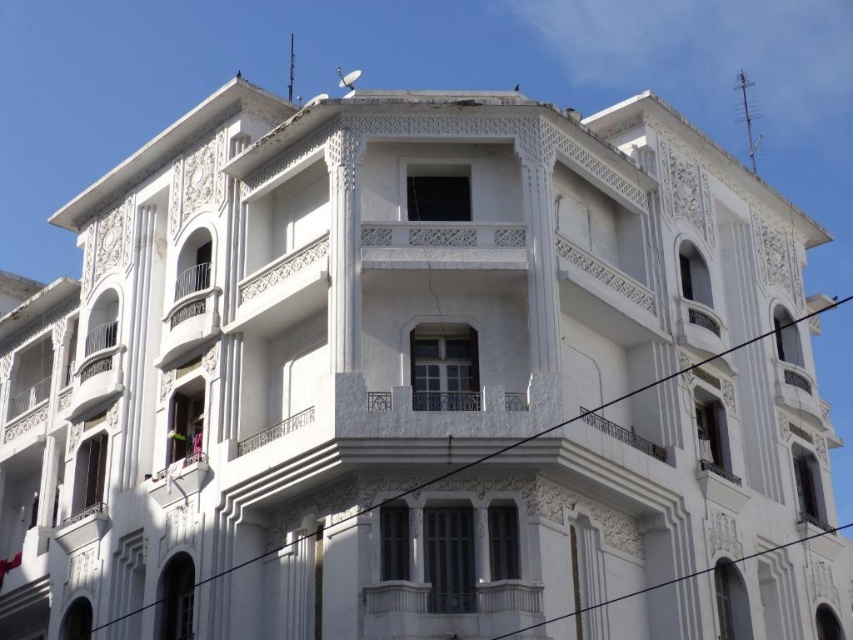
Question: Which of the following is the farthest from the observer?

Choices:
 (A) metallic wire at lower right
 (B) black wire at center

Answer: (B)

Question: Which point is closer to the camera?

Choices:
 (A) black wire at center
 (B) metallic wire at lower right

Answer: (B)

Question: In this image, where is black wire at center located relative to metallic wire at lower right?

Choices:
 (A) above
 (B) below

Answer: (A)

Question: In this image, where is black wire at center located relative to metallic wire at lower right?

Choices:
 (A) above
 (B) below

Answer: (A)

Question: Where is black wire at center located in relation to metallic wire at lower right in the image?

Choices:
 (A) above
 (B) below

Answer: (A)